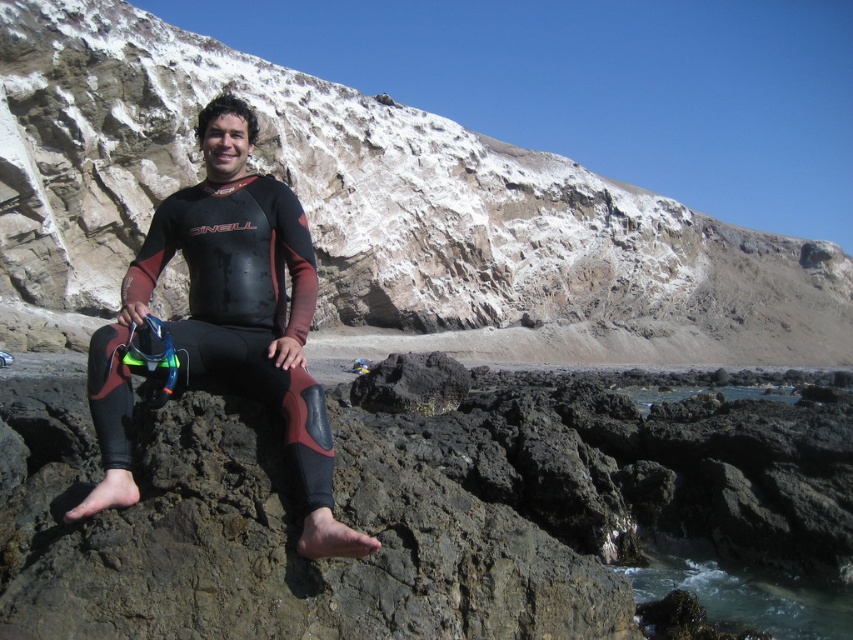
Question: Is rugged stone cliff at center to the right of black matte wetsuit at center from the viewer's perspective?

Choices:
 (A) yes
 (B) no

Answer: (A)

Question: Which point is closer to the camera taking this photo?

Choices:
 (A) (836, 604)
 (B) (451, 186)
 (C) (335, 545)

Answer: (C)

Question: Considering the real-world distances, which object is closest to the black matte wetsuit at center?

Choices:
 (A) clear water at lower right
 (B) rugged stone cliff at center

Answer: (A)

Question: Can you confirm if rugged stone cliff at center is positioned to the left of clear water at lower right?

Choices:
 (A) no
 (B) yes

Answer: (A)

Question: Does rugged stone cliff at center appear on the left side of black matte wetsuit at center?

Choices:
 (A) no
 (B) yes

Answer: (A)

Question: Among these points, which one is farthest from the camera?

Choices:
 (A) (726, 579)
 (B) (498, 340)
 (C) (247, 269)

Answer: (B)